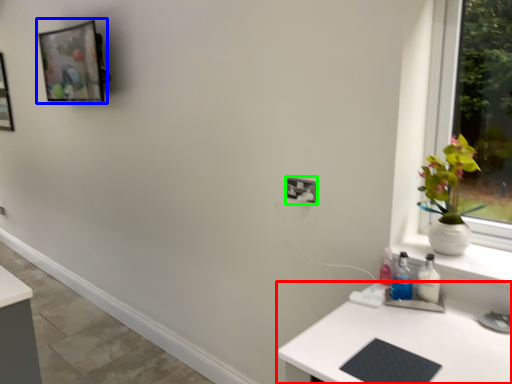
Question: Considering the real-world distances, which object is farthest from desk (highlighted by a red box)? picture frame (highlighted by a blue box) or electric outlet (highlighted by a green box)?

Choices:
 (A) picture frame
 (B) electric outlet

Answer: (A)